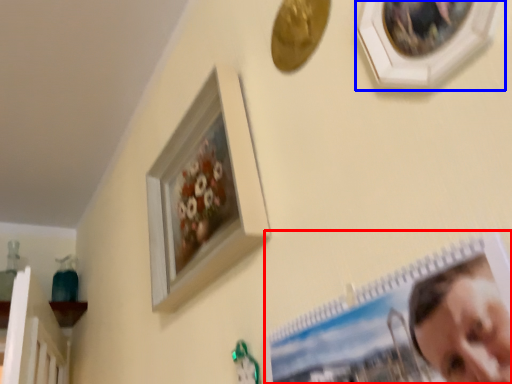
Question: Which object appears closest to the camera in this image, picture frame (highlighted by a red box) or picture frame (highlighted by a blue box)?

Choices:
 (A) picture frame
 (B) picture frame

Answer: (A)